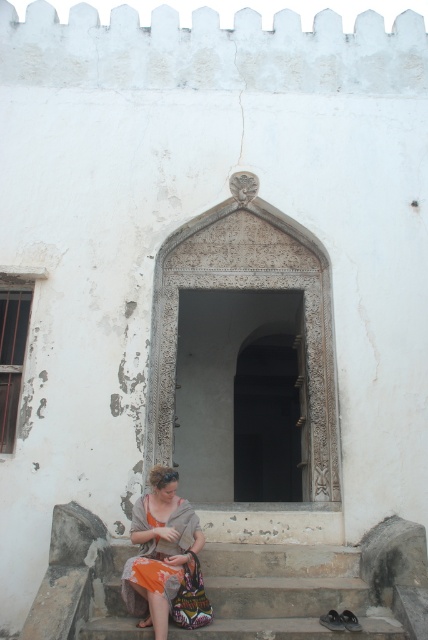
You are a traveler approaching the white building and need to decide whether to step onto the smooth stone stairs at lower center or the orange fabric at lower left. Based on their sizes, which option might be more stable for walking?

The orange fabric at lower left is larger than the smooth stone stairs at lower center, so it might be more stable for walking.

You are a visitor approaching the building and see the smooth stone stairs at lower center and the orange fabric at lower left. Which object is located to the left of the other?

The orange fabric at lower left is located to the left of the smooth stone stairs at lower center.

You are standing in front of the weathered white building with the ornate arched doorway. You notice two points marked on the wall near the doorway. The first point is at coordinates point (386, 611) and the second is at point (178, 538). If you were to reach out and touch these points, which one would require you to stretch your arm further to touch?

Point (178, 538) would require stretching your arm further because it is farther from the camera compared to point (386, 611), which is closer.